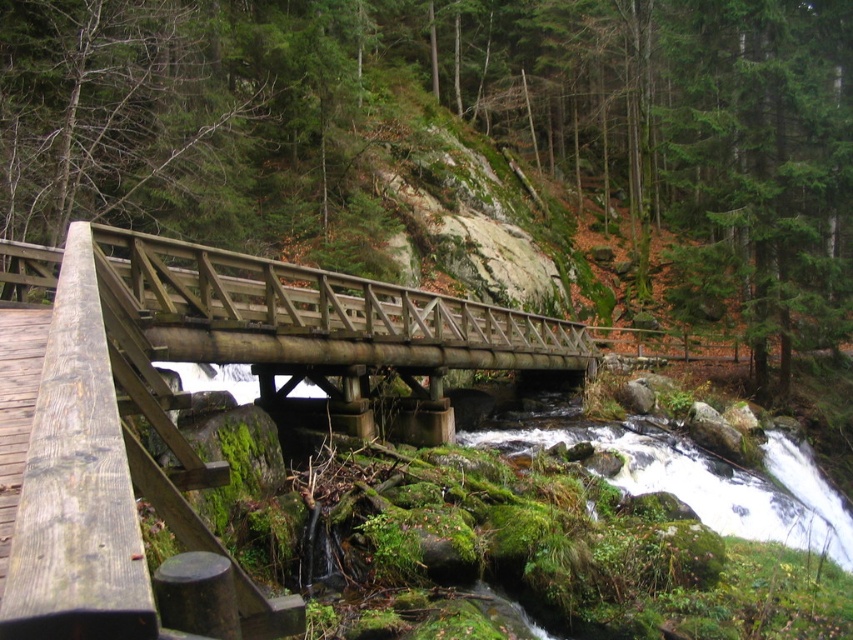
You are a hiker carrying a heavy backpack and need to cross the stream. The weathered wood foot bridge at center is partially damaged. Can you step onto the green mossy rocks at center to safely cross the stream?

The green mossy rocks at center are taller than the weathered wood foot bridge at center, so stepping onto them might be possible but could be unstable due to their height difference. It is safer to avoid the rocks and find another crossing point.

You are a hiker carrying a heavy backpack and need to cross the stream. The green mossy rocks at center are slippery, and the weathered wood foot bridge at center is sturdy. Given the distance between them, can you safely walk from the rocks to the bridge without getting your feet wet?

The distance between the green mossy rocks at center and the weathered wood foot bridge at center is 13.12 meters. Since the stream is fast moving and the rocks are slippery, attempting to cross this distance would likely result in falling into the water. It is safer to use the weathered wood foot bridge at center instead.

You are a hiker trying to cross the weathered wood foot bridge at center. You notice some green mossy rocks at center nearby. Are the rocks above or below the bridge?

The green mossy rocks at center are above the weathered wood foot bridge at center.